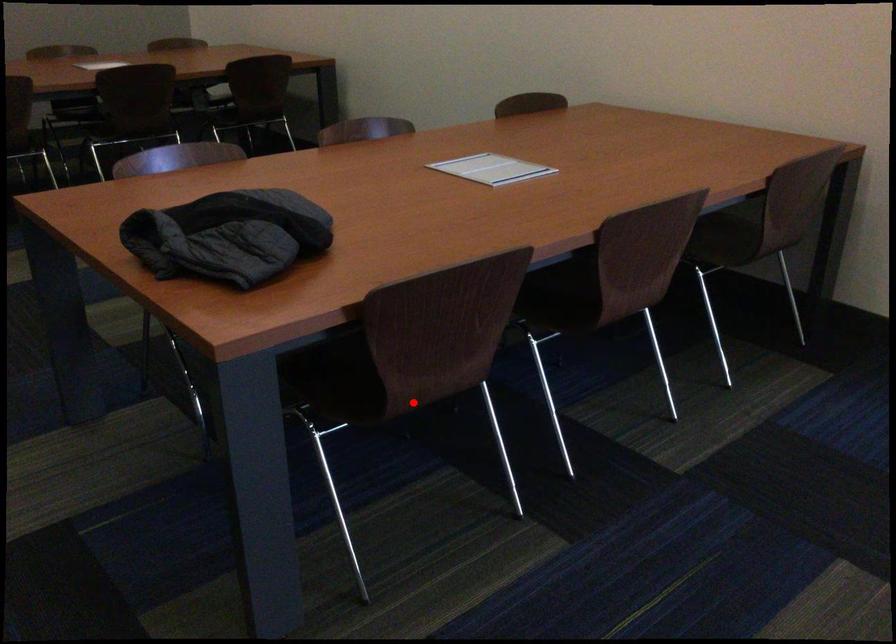
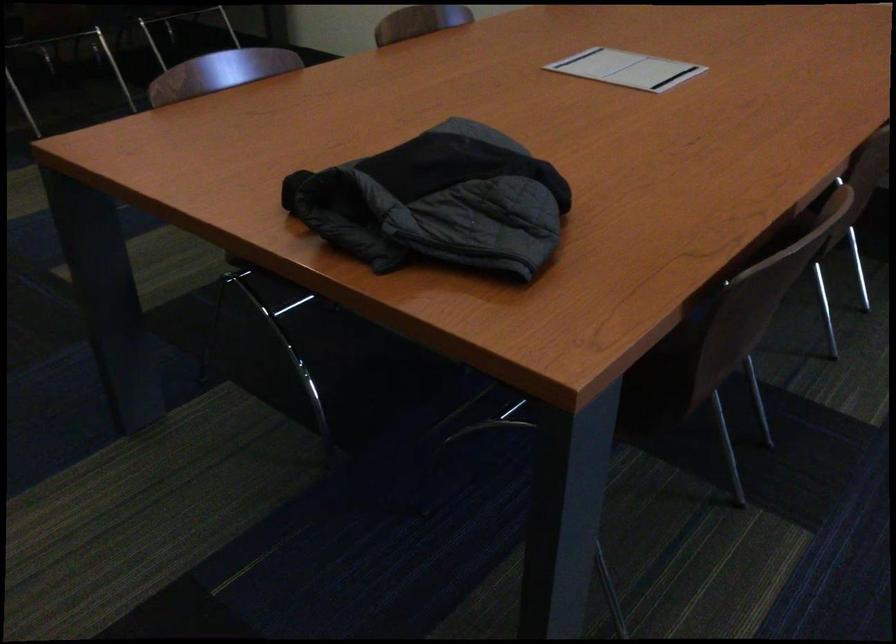
Locate, in the second image, the point that corresponds to the highlighted location in the first image.

(666, 386)